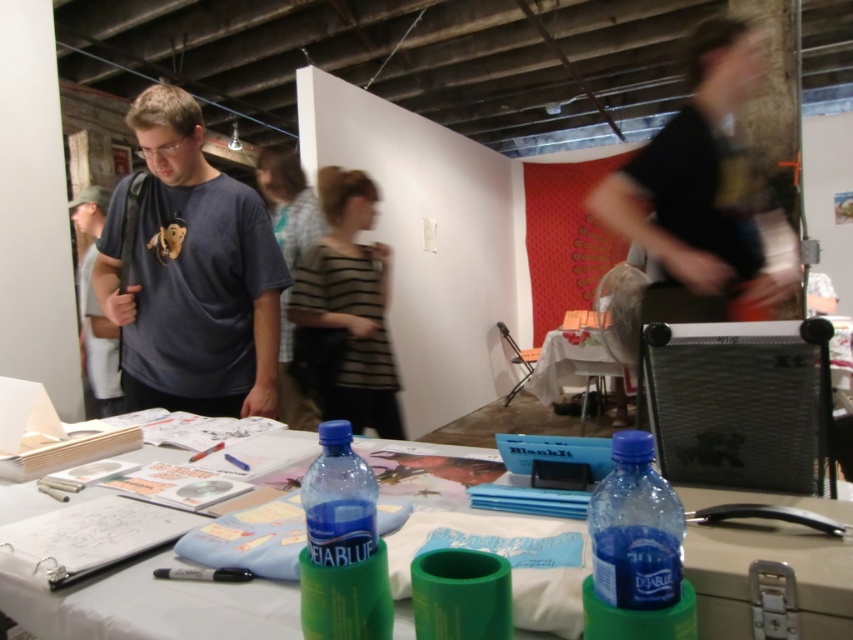
Can you confirm if black matte shirt at upper right is thinner than matte gray t-shirt at left?

Incorrect, black matte shirt at upper right's width is not less than matte gray t-shirt at left's.

Does black matte shirt at upper right have a smaller size compared to matte gray t-shirt at left?

No.

Between point (669, 316) and point (107, 362), which one is positioned in front?

Positioned in front is point (669, 316).

This screenshot has height=640, width=853. In order to click on black matte shirt at upper right in this screenshot , I will do `click(704, 193)`.

Who is lower down, translucent plastic table at center or black matte shirt at upper right?

translucent plastic table at center is lower down.

Can you confirm if translucent plastic table at center is taller than black matte shirt at upper right?

Incorrect, translucent plastic table at center's height is not larger of black matte shirt at upper right's.

Does point (788, 545) come closer to viewer compared to point (692, 198)?

That is True.

Find the location of `translucent plastic table at center`. translucent plastic table at center is located at coordinates (152, 605).

Between black matte shirt at upper right and blue translucent bottle at center, which one appears on the left side from the viewer's perspective?

blue translucent bottle at center

Does black matte shirt at upper right lie in front of blue translucent bottle at center?

That is False.

Is point (727, 54) farther from viewer compared to point (643, 529)?

Yes, it is behind point (643, 529).

The image size is (853, 640). In order to click on black matte shirt at upper right in this screenshot , I will do `click(704, 193)`.